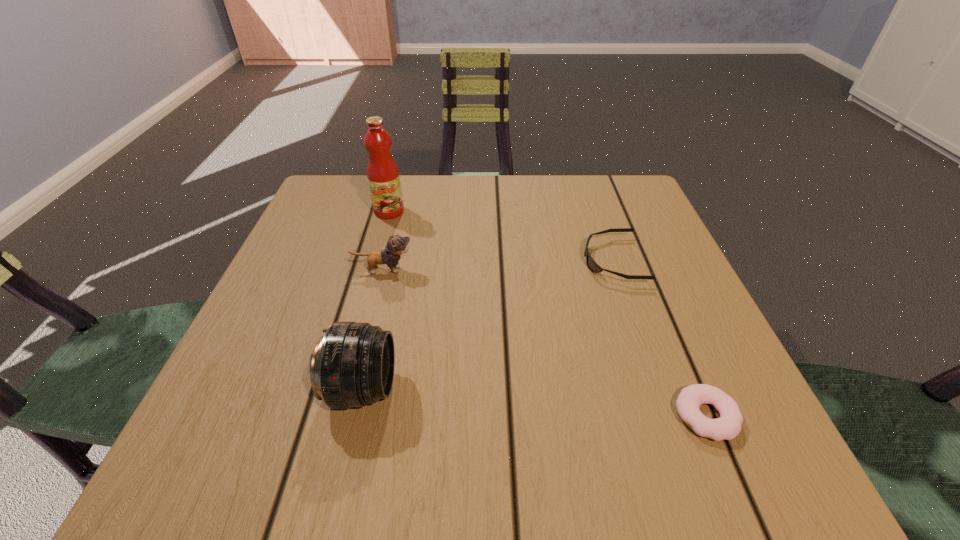
Identify the location of vacant space that satisfies the following two spatial constraints: 1. on the front-facing side of the doughnut; 2. on the left side of the sunglasses. The height and width of the screenshot is (540, 960). (667, 416).

This screenshot has width=960, height=540. Identify the location of vacant position in the image that satisfies the following two spatial constraints: 1. on the back side of the doughnut; 2. on the front-facing side of the kitten. (645, 270).

Find the location of a particular element. vacant point that satisfies the following two spatial constraints: 1. at the front element of the doughnut; 2. on the left side of the fourth shortest object is located at coordinates (356, 416).

This screenshot has height=540, width=960. Find the location of `free spot that satisfies the following two spatial constraints: 1. at the front element of the doughnut; 2. on the right side of the telephoto lens`. free spot that satisfies the following two spatial constraints: 1. at the front element of the doughnut; 2. on the right side of the telephoto lens is located at coordinates click(x=356, y=416).

Locate an element on the screen. This screenshot has height=540, width=960. free space that satisfies the following two spatial constraints: 1. on the front-facing side of the third tallest object; 2. on the right side of the doughnut is located at coordinates (347, 416).